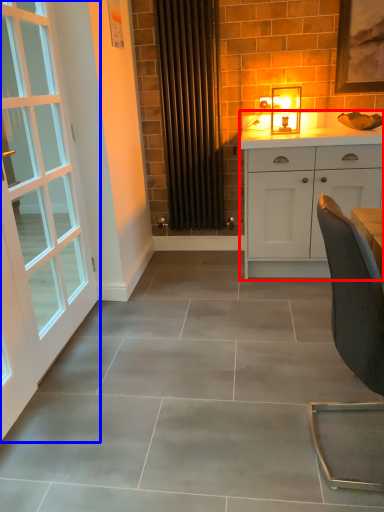
Question: Which of the following is the farthest to the observer, cabinetry (highlighted by a red box) or door (highlighted by a blue box)?

Choices:
 (A) cabinetry
 (B) door

Answer: (A)